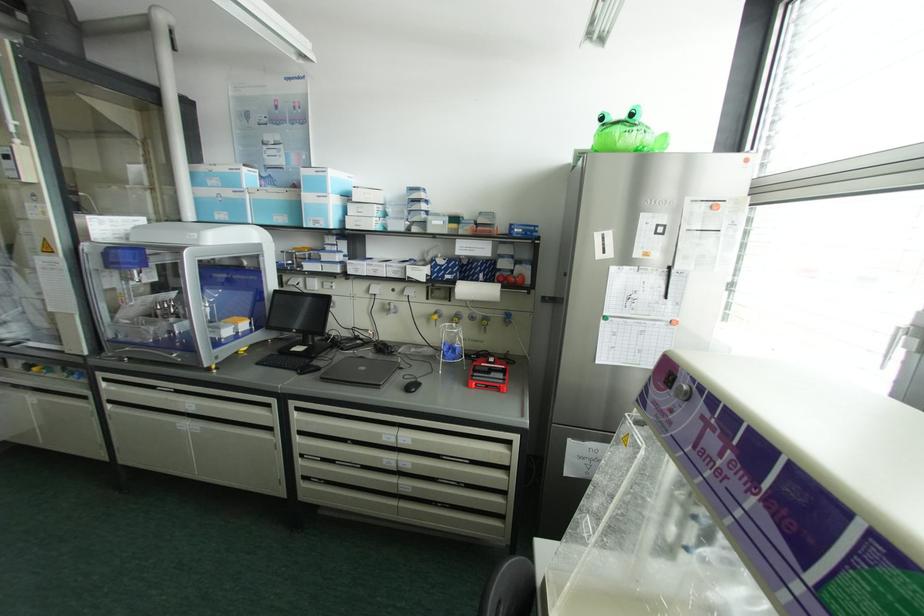
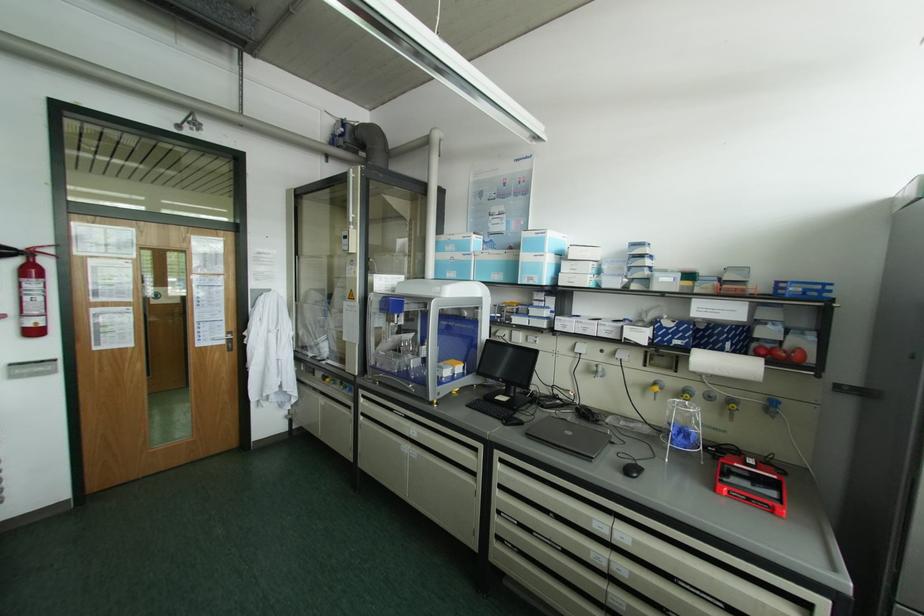
Locate, in the second image, the point that corresponds to (x=226, y=193) in the first image.

(457, 256)